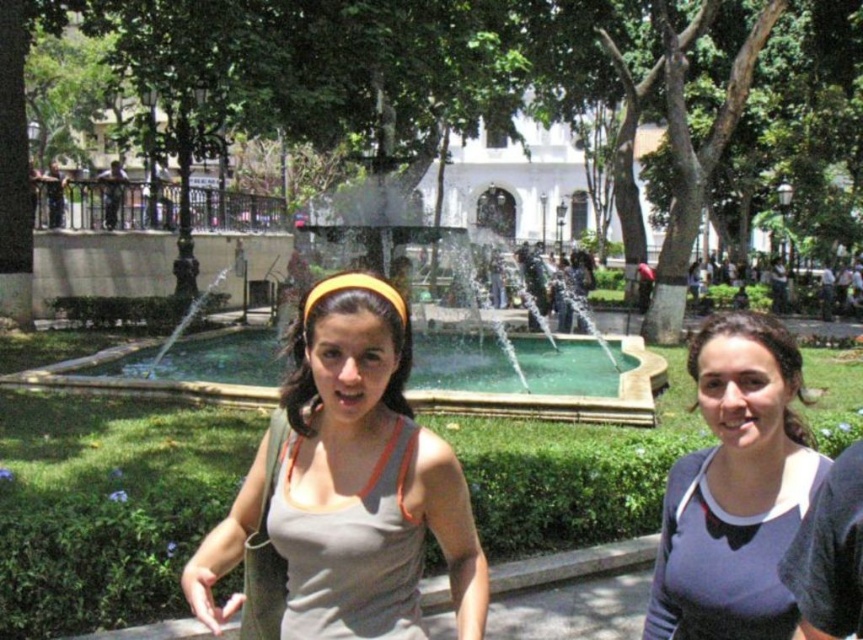
Question: Among these objects, which one is nearest to the camera?

Choices:
 (A) gray matte tank top at center
 (B) matte gray tank top at center

Answer: (A)

Question: Which point appears farthest from the camera in this image?

Choices:
 (A) (717, 596)
 (B) (253, 388)
 (C) (343, 524)

Answer: (B)

Question: Does gray matte tank top at center have a smaller size compared to green stone fountain at center?

Choices:
 (A) no
 (B) yes

Answer: (B)

Question: Can you confirm if matte gray tank top at center is positioned below green stone fountain at center?

Choices:
 (A) no
 (B) yes

Answer: (B)

Question: Does matte gray tank top at center have a larger size compared to green stone fountain at center?

Choices:
 (A) no
 (B) yes

Answer: (A)

Question: Which point is farther from the camera taking this photo?

Choices:
 (A) (740, 369)
 (B) (318, 429)
 (C) (328, 232)

Answer: (C)